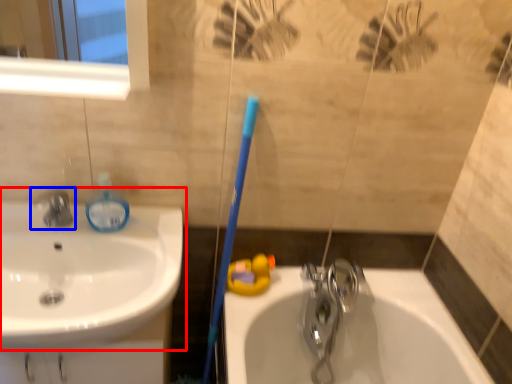
Question: Which object is further to the camera taking this photo, sink (highlighted by a red box) or tap (highlighted by a blue box)?

Choices:
 (A) sink
 (B) tap

Answer: (B)